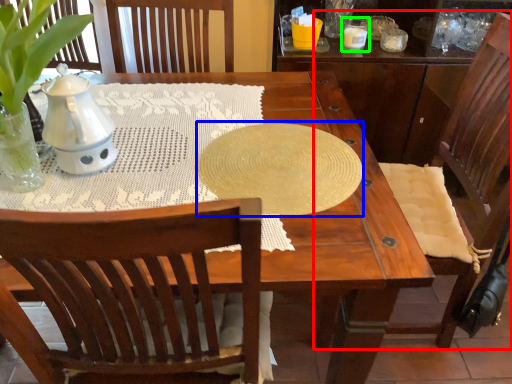
Question: Based on their relative distances, which object is nearer to chair (highlighted by a red box)? Choose from oval (highlighted by a blue box) and candle holder (highlighted by a green box).

Choices:
 (A) oval
 (B) candle holder

Answer: (A)